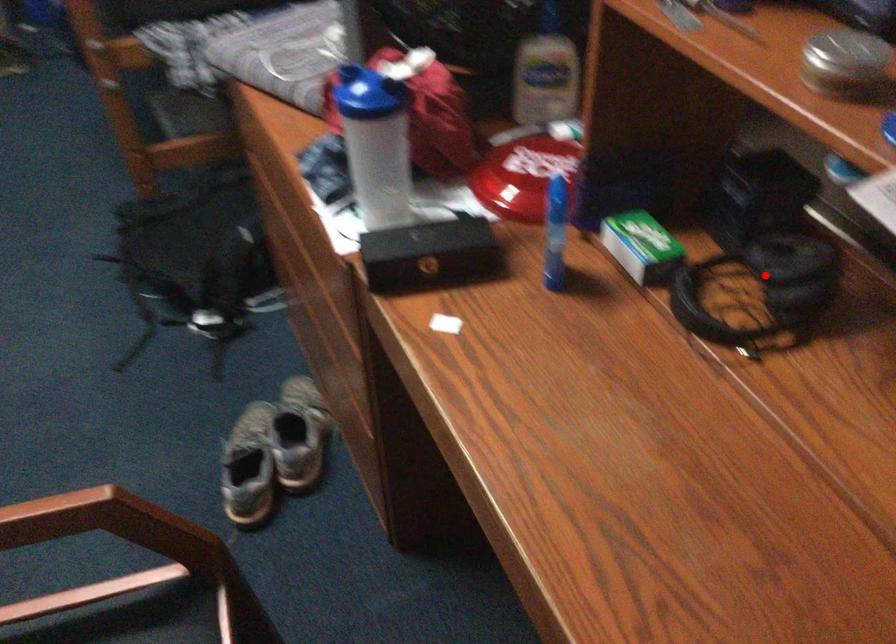
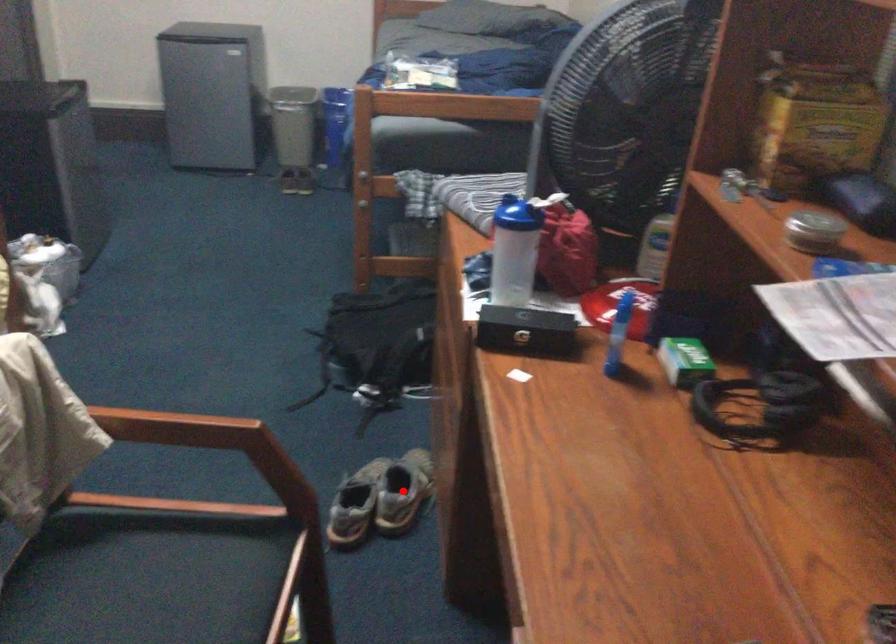
I am providing you with two images of the same scene from different viewpoints. A red point is marked on the first image and another point is marked on the second image. Is the red point in image1 aligned with the point shown in image2?

No